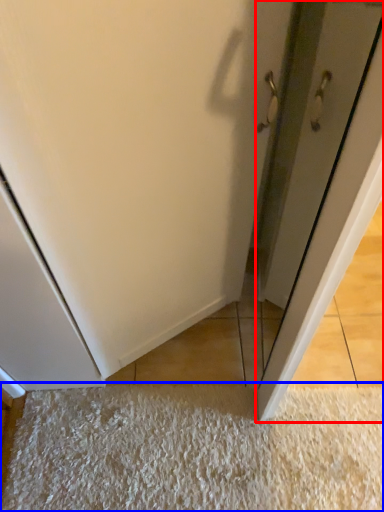
Question: Which object is closer to the camera taking this photo, door (highlighted by a red box) or mat (highlighted by a blue box)?

Choices:
 (A) door
 (B) mat

Answer: (A)